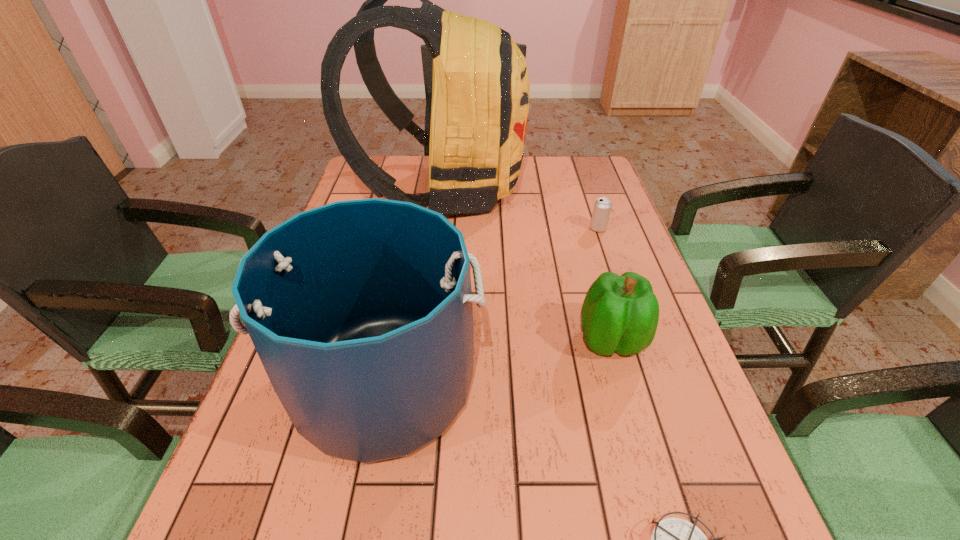
What are the coordinates of `free spot between the fourth tallest object and the second tallest object` in the screenshot? It's located at (491, 306).

I want to click on vacant area between the bucket and the beer can, so click(x=491, y=306).

The width and height of the screenshot is (960, 540). Find the location of `free area in between the fourth shortest object and the third shortest object`. free area in between the fourth shortest object and the third shortest object is located at coordinates (497, 362).

Select which object is the second closest to the nearest object. Please provide its 2D coordinates. Your answer should be formatted as a tuple, i.e. [(x, y)], where the tuple contains the x and y coordinates of a point satisfying the conditions above.

[(620, 314)]

Find the location of a particular element. This screenshot has height=540, width=960. object that stands as the second closest to the shortest object is located at coordinates (620, 314).

Locate an element on the screen. Image resolution: width=960 pixels, height=540 pixels. free space that satisfies the following two spatial constraints: 1. on the front-facing side of the tallest object; 2. on the front side of the bucket is located at coordinates (420, 383).

This screenshot has width=960, height=540. In order to click on vacant region that satisfies the following two spatial constraints: 1. on the back side of the third shortest object; 2. on the front-facing side of the backpack in this screenshot , I will do `click(568, 190)`.

I want to click on free space in the image that satisfies the following two spatial constraints: 1. on the front-facing side of the tallest object; 2. on the left side of the fourth tallest object, so click(439, 228).